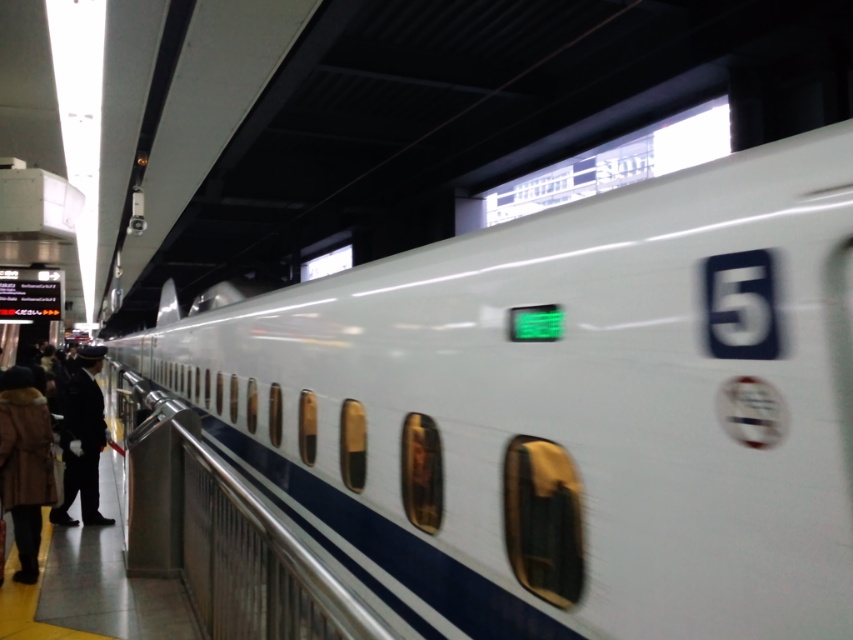
Between white glossy train at center and dark blue uniform at left, which one is positioned higher?

white glossy train at center

Which of these two, white glossy train at center or dark blue uniform at left, stands taller?

white glossy train at center

Is point (427, 289) positioned before point (83, 442)?

Yes, it is.

Where is `white glossy train at center`? white glossy train at center is located at coordinates (567, 408).

What are the coordinates of `white glossy train at center` in the screenshot? It's located at 567,408.

Can you confirm if white glossy train at center is taller than brown fuzzy coat at lower left?

Correct, white glossy train at center is much taller as brown fuzzy coat at lower left.

You are a GUI agent. You are given a task and a screenshot of the screen. Output one action in this format:
    pyautogui.click(x=<x>, y=<y>)
    Task: Click on the white glossy train at center
    The image size is (853, 640).
    Given the screenshot: What is the action you would take?
    pyautogui.click(x=567, y=408)

Looking at this image, who is lower down, brown fuzzy coat at lower left or dark blue uniform at left?

dark blue uniform at left

Is brown fuzzy coat at lower left to the left of dark blue uniform at left from the viewer's perspective?

In fact, brown fuzzy coat at lower left is to the right of dark blue uniform at left.

Is point (16, 545) more distant than point (96, 428)?

No.

Where is `brown fuzzy coat at lower left`? brown fuzzy coat at lower left is located at coordinates (24, 464).